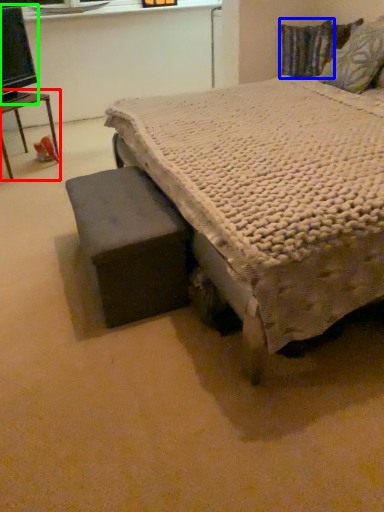
Question: Which is farther away from table (highlighted by a red box)? pillow (highlighted by a blue box) or computer monitor (highlighted by a green box)?

Choices:
 (A) pillow
 (B) computer monitor

Answer: (A)